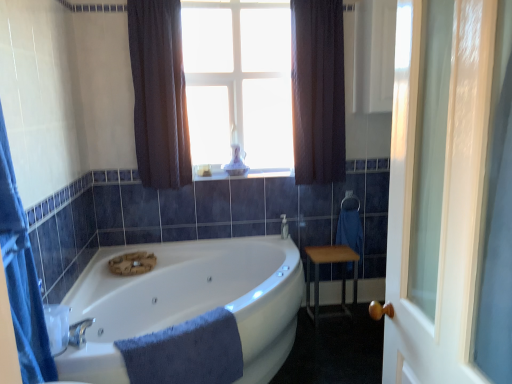
Question: From a real-world perspective, is transparent glass candle at upper center on top of silver metallic towel bar at right?

Choices:
 (A) no
 (B) yes

Answer: (B)

Question: Is transparent glass candle at upper center wider than silver metallic towel bar at right?

Choices:
 (A) no
 (B) yes

Answer: (A)

Question: Can you confirm if transparent glass candle at upper center is smaller than silver metallic towel bar at right?

Choices:
 (A) yes
 (B) no

Answer: (B)

Question: Is transparent glass candle at upper center directly adjacent to silver metallic towel bar at right?

Choices:
 (A) yes
 (B) no

Answer: (B)

Question: Is transparent glass candle at upper center far away from silver metallic towel bar at right?

Choices:
 (A) no
 (B) yes

Answer: (B)

Question: Is transparent glass candle at upper center looking in the opposite direction of silver metallic towel bar at right?

Choices:
 (A) yes
 (B) no

Answer: (B)

Question: Can we say white glossy window sill at center lies outside blue soft towel at lower center?

Choices:
 (A) yes
 (B) no

Answer: (A)

Question: Considering the relative sizes of white glossy window sill at center and blue soft towel at lower center in the image provided, is white glossy window sill at center bigger than blue soft towel at lower center?

Choices:
 (A) no
 (B) yes

Answer: (A)

Question: Considering the relative positions of white glossy window sill at center and blue soft towel at lower center in the image provided, is white glossy window sill at center in front of blue soft towel at lower center?

Choices:
 (A) yes
 (B) no

Answer: (B)

Question: Can you confirm if white glossy window sill at center is taller than blue soft towel at lower center?

Choices:
 (A) yes
 (B) no

Answer: (B)

Question: Is white glossy window sill at center facing away from blue soft towel at lower center?

Choices:
 (A) yes
 (B) no

Answer: (B)

Question: From the image's perspective, is white glossy window sill at center located beneath blue soft towel at lower center?

Choices:
 (A) yes
 (B) no

Answer: (B)

Question: From the image's perspective, is clear glass door at right over dark fabric curtain at upper center, arranged as the 1th curtain when viewed from the left?

Choices:
 (A) yes
 (B) no

Answer: (B)